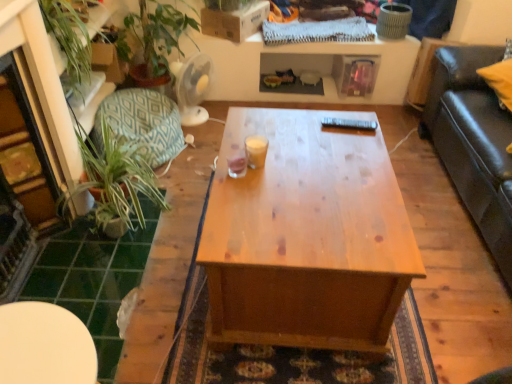
In order to click on unoccupied space behind translucent glass at center, which appears as the 1th coffee cup when viewed from the left in this screenshot , I will do `click(243, 144)`.